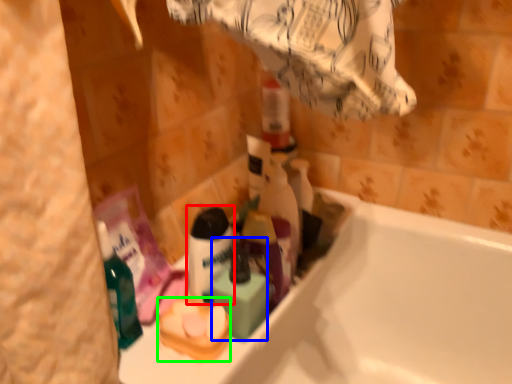
Question: Considering the real-world distances, which object is closest to shaving cream (highlighted by a red box)? mouthwash (highlighted by a blue box) or product (highlighted by a green box).

Choices:
 (A) mouthwash
 (B) product

Answer: (A)